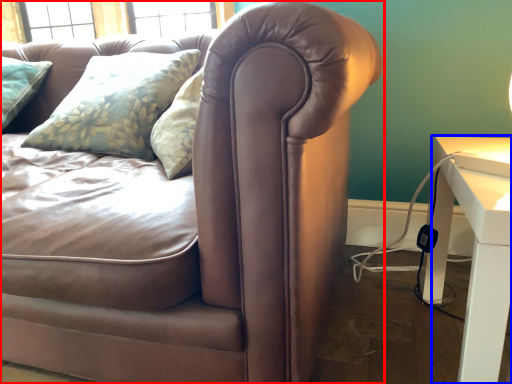
Question: Which object is closer to the camera taking this photo, studio couch (highlighted by a red box) or table (highlighted by a blue box)?

Choices:
 (A) studio couch
 (B) table

Answer: (A)